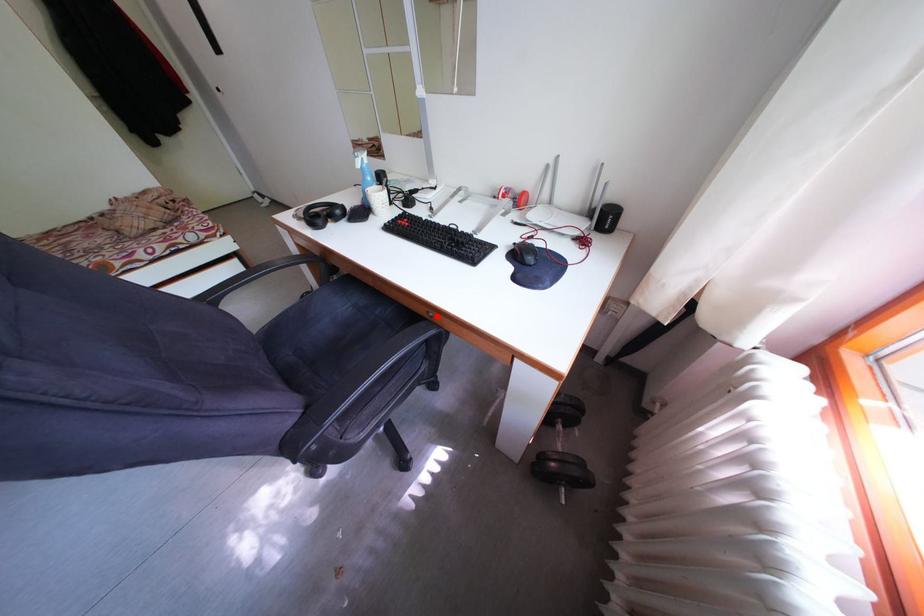
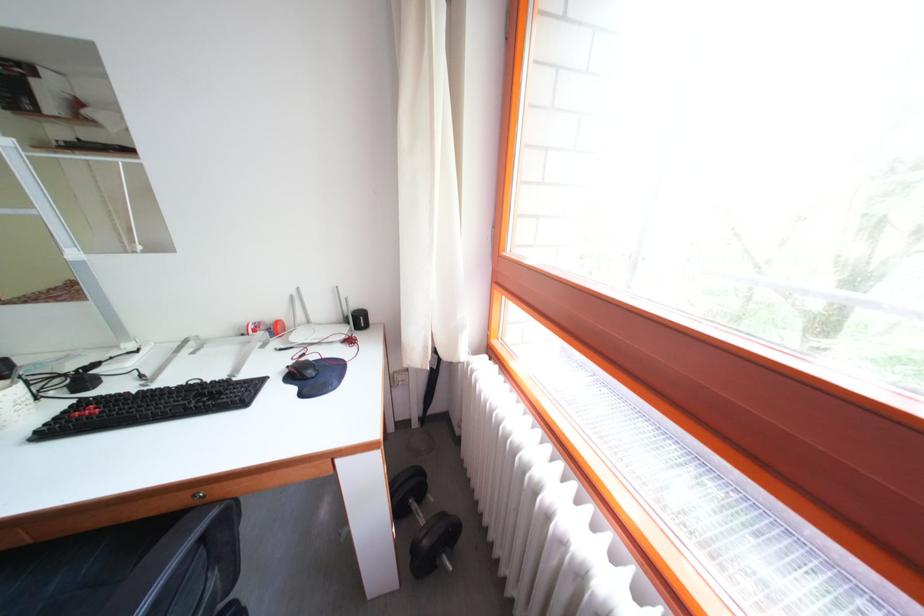
In the second image, find the point that corresponds to the highlighted location in the first image.

(203, 496)